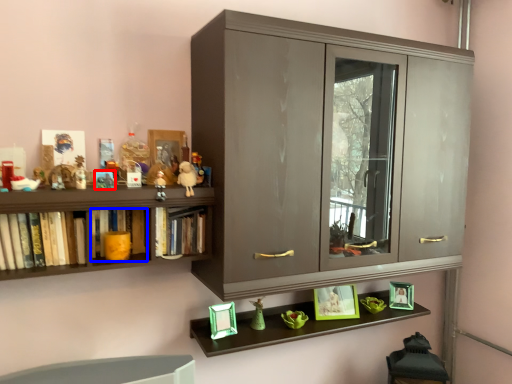
Question: Among these objects, which one is farthest to the camera, toy (highlighted by a red box) or book (highlighted by a blue box)?

Choices:
 (A) toy
 (B) book

Answer: (B)